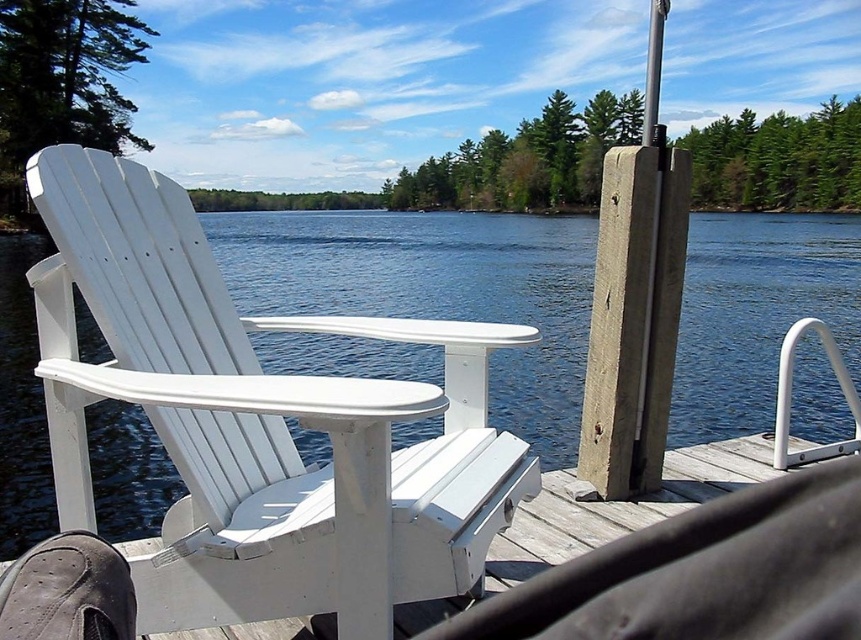
Question: Which object appears closest to the camera in this image?

Choices:
 (A) white wood beach chair at left
 (B) white wood deck at center
 (C) smooth gray pole at right
 (D) blue water at center

Answer: (A)

Question: Which point is closer to the camera?

Choices:
 (A) smooth gray pole at right
 (B) blue water at center
 (C) white wood deck at center

Answer: (B)

Question: Considering the real-world distances, which object is closest to the smooth gray pole at right?

Choices:
 (A) white wood deck at center
 (B) blue water at center
 (C) white wood beach chair at left

Answer: (A)

Question: Is white wood beach chair at left bigger than blue water at center?

Choices:
 (A) no
 (B) yes

Answer: (A)

Question: Can you confirm if white wood beach chair at left is positioned to the right of smooth gray pole at right?

Choices:
 (A) yes
 (B) no

Answer: (B)

Question: Is white wood beach chair at left below white wood deck at center?

Choices:
 (A) no
 (B) yes

Answer: (A)